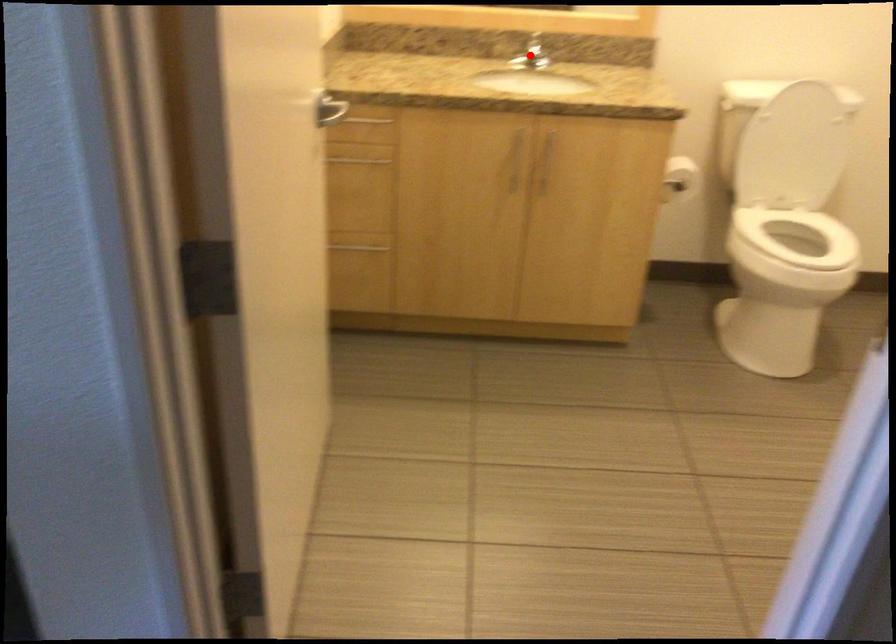
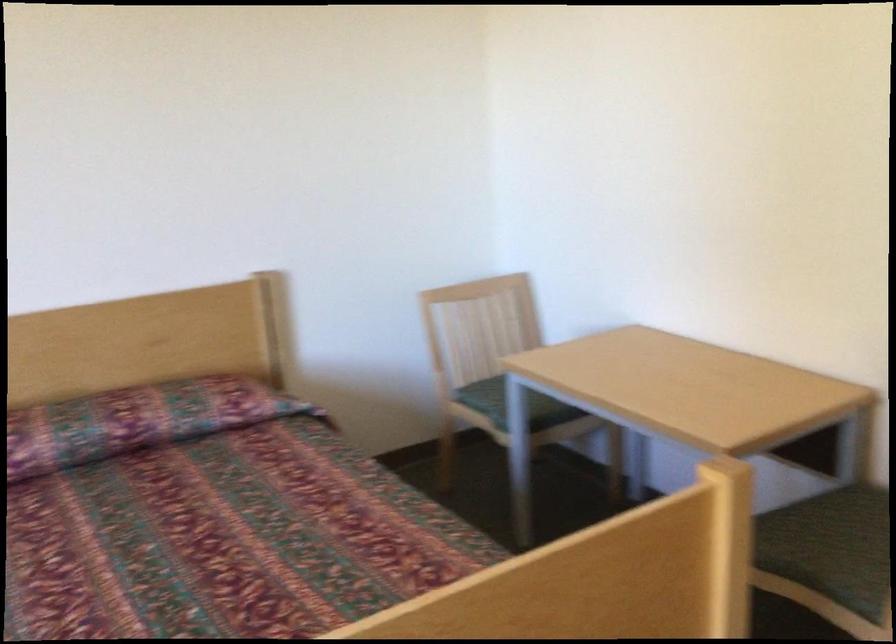
Question: I am providing you with two images of the same scene from different viewpoints. A red point is marked on the first image. At the location where the point appears in image 1, is it still visible in image 2?

Choices:
 (A) Yes
 (B) No

Answer: (B)